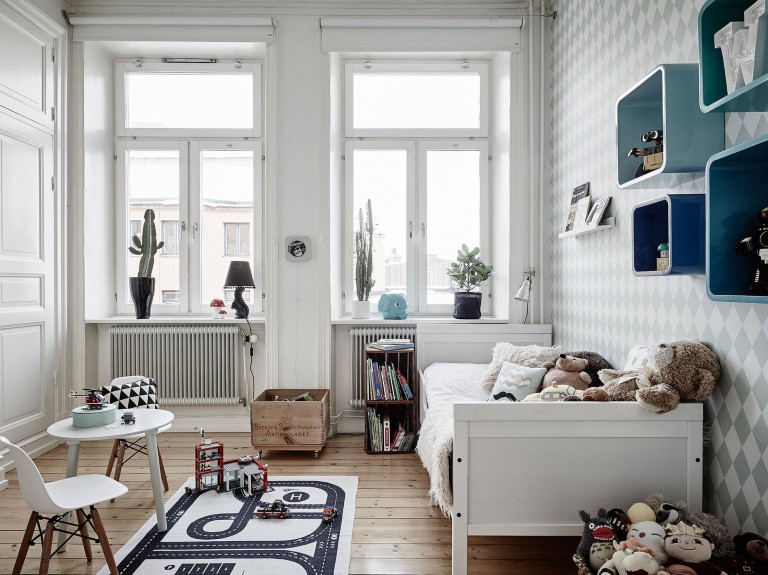
You are a GUI agent. You are given a task and a screenshot of the screen. Output one action in this format:
    pyautogui.click(x=<x>, y=<y>)
    Task: Click on the closet door
    
    Given the screenshot: What is the action you would take?
    pyautogui.click(x=12, y=230)